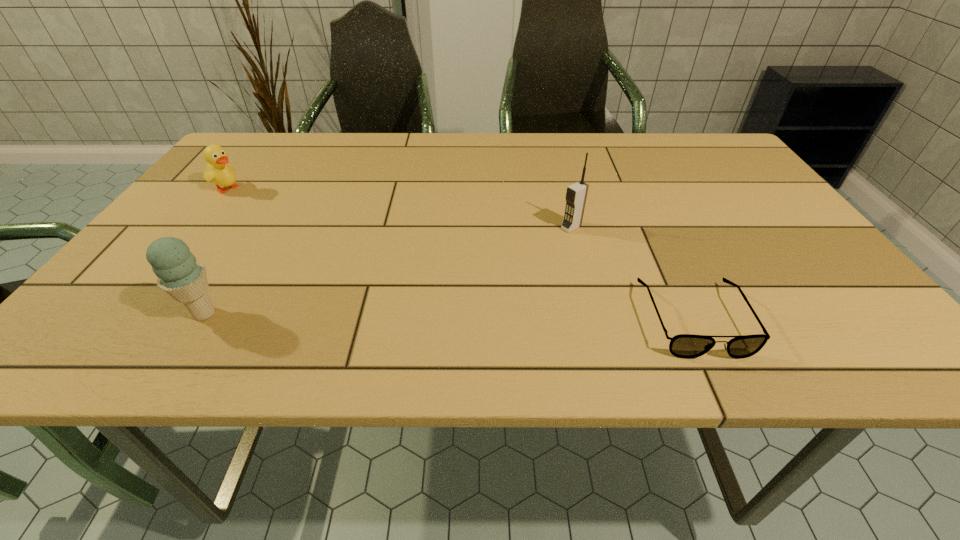
Where is `ice cream`? This screenshot has width=960, height=540. ice cream is located at coordinates (179, 274).

Identify the location of the shortest object. (x=687, y=346).

The image size is (960, 540). I want to click on spectacles, so pyautogui.click(x=687, y=346).

Where is `the third nearest object`? The width and height of the screenshot is (960, 540). the third nearest object is located at coordinates (576, 194).

Locate an element on the screen. cellular telephone is located at coordinates (576, 194).

Where is `the leftmost object`? Image resolution: width=960 pixels, height=540 pixels. the leftmost object is located at coordinates (218, 171).

At what (x,y) coordinates should I click in order to perform the action: click on duckling. Please return your answer as a coordinate pair (x, y). The width and height of the screenshot is (960, 540). Looking at the image, I should click on (218, 171).

At what (x,y) coordinates should I click in order to perform the action: click on free location located 0.120m on the back of the third object from right to left. Please return your answer as a coordinate pair (x, y). Looking at the image, I should click on (238, 258).

Locate an element on the screen. The image size is (960, 540). free space located 0.070m on the front-facing side of the second farthest object is located at coordinates (542, 244).

The image size is (960, 540). I want to click on free space located 0.110m on the front-facing side of the second farthest object, so click(529, 251).